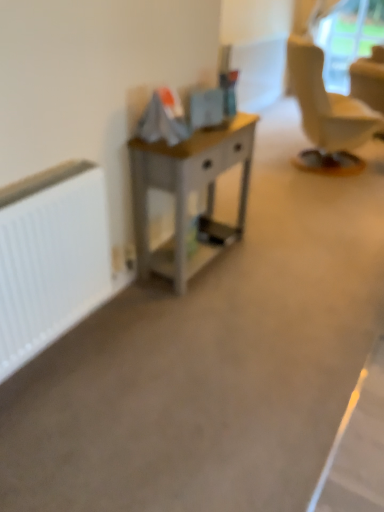
Identify the location of vacant region to the right of wooden desk at center. (278, 261).